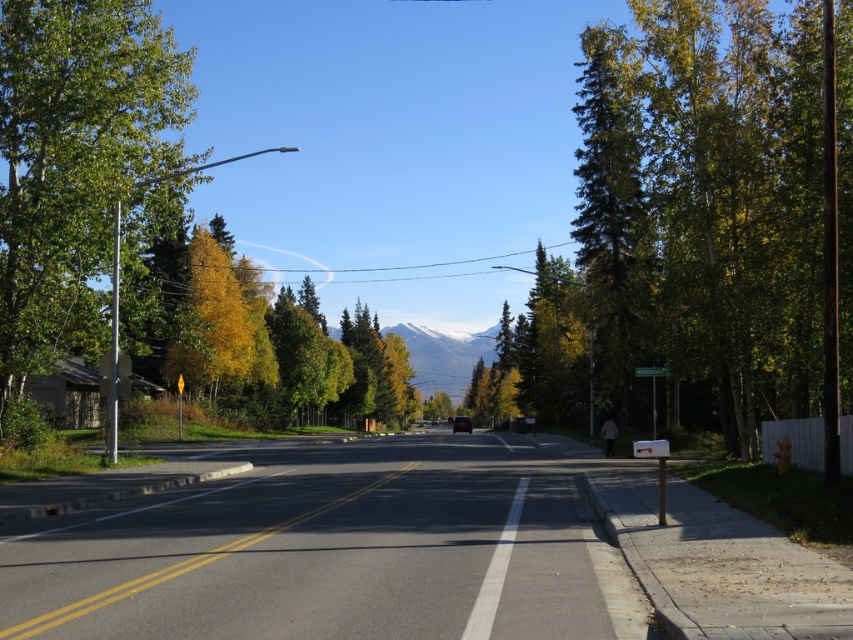
Question: Which is nearer to the green leafy tree at right?

Choices:
 (A) snowy mountain at center
 (B) green plastic street sign at center
 (C) green leafy tree at left

Answer: (C)

Question: Where is green leafy tree at left located in relation to green matte tree at right in the image?

Choices:
 (A) above
 (B) below

Answer: (B)

Question: Which of the following is the closest to the observer?

Choices:
 (A) (402, 333)
 (B) (177, 86)

Answer: (B)

Question: Among these points, which one is farthest from the camera?

Choices:
 (A) (654, 376)
 (B) (659, 353)
 (C) (421, 365)
 (D) (33, 154)

Answer: (C)

Question: Considering the relative positions of yellow leafy tree at left and green plastic street sign at center in the image provided, where is yellow leafy tree at left located with respect to green plastic street sign at center?

Choices:
 (A) below
 (B) above

Answer: (B)

Question: Observing the image, what is the correct spatial positioning of green leafy tree at left in reference to yellow leafy tree at left?

Choices:
 (A) above
 (B) below

Answer: (A)